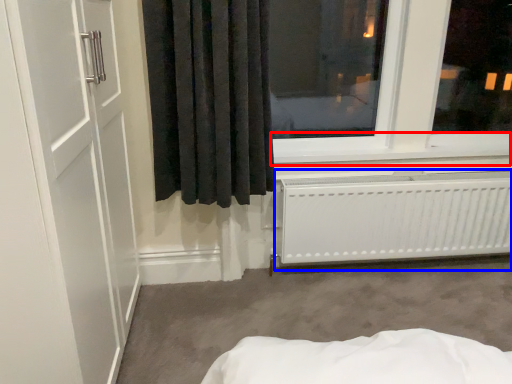
Question: Which object appears closest to the camera in this image, window sill (highlighted by a red box) or radiator (highlighted by a blue box)?

Choices:
 (A) window sill
 (B) radiator

Answer: (B)